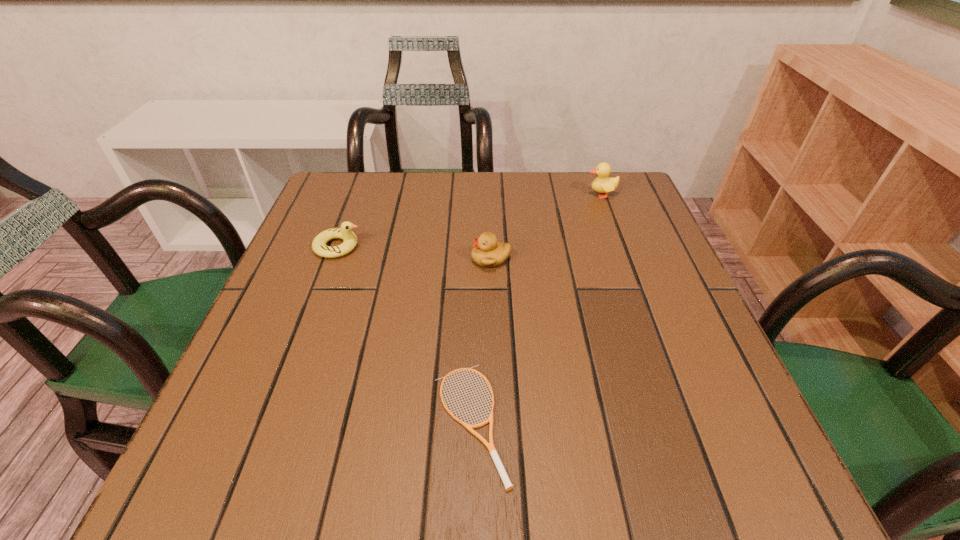
Image resolution: width=960 pixels, height=540 pixels. What are the coordinates of `vacant space at the near edge` in the screenshot? It's located at (585, 482).

Where is `free region at the left edge of the desktop`? free region at the left edge of the desktop is located at coordinates (238, 385).

Where is `free space at the right edge of the desktop`? This screenshot has width=960, height=540. free space at the right edge of the desktop is located at coordinates (743, 429).

In the image, there is a desktop. Where is `vacant area at the far left corner`? Image resolution: width=960 pixels, height=540 pixels. vacant area at the far left corner is located at coordinates (366, 196).

Find the location of a particular element. Image resolution: width=960 pixels, height=540 pixels. vacant space at the near right corner of the desktop is located at coordinates (x=730, y=448).

Identify the location of vacant area that lies between the leftmost duckling and the rightmost duckling. (469, 220).

This screenshot has height=540, width=960. Find the location of `vacant space in between the second duckling from left to right and the leftmost duckling`. vacant space in between the second duckling from left to right and the leftmost duckling is located at coordinates (415, 253).

I want to click on empty space between the leftmost object and the second duckling from right to left, so click(415, 253).

The height and width of the screenshot is (540, 960). Find the location of `vacant space that's between the second duckling from left to right and the rightmost duckling`. vacant space that's between the second duckling from left to right and the rightmost duckling is located at coordinates (x=546, y=227).

The height and width of the screenshot is (540, 960). I want to click on vacant space that's between the second duckling from left to right and the leftmost object, so (415, 253).